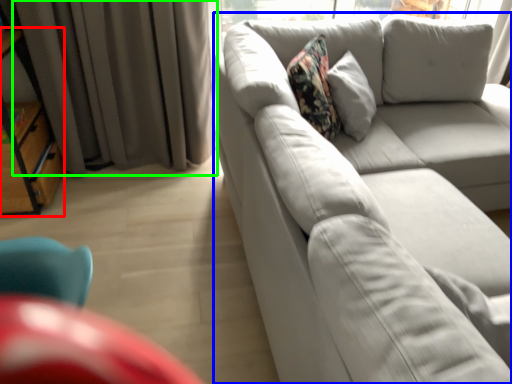
Question: Considering the real-world distances, which object is closest to bookshelf (highlighted by a red box)? studio couch (highlighted by a blue box) or curtain (highlighted by a green box).

Choices:
 (A) studio couch
 (B) curtain

Answer: (B)